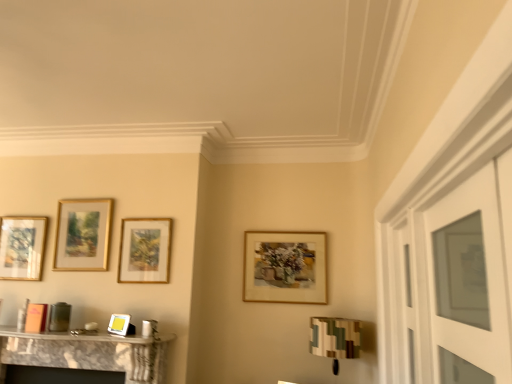
Identify the location of matte gold picture frame at upper center, the third picture frame from the left. (144, 250).

In order to face wooden picture frame at center, the first picture frame positioned from the right, should I rotate leftwards or rightwards?

You should rotate right by 3.938 degrees.

Describe the element at coordinates (455, 282) in the screenshot. I see `clear glass door at right` at that location.

You are a GUI agent. You are given a task and a screenshot of the screen. Output one action in this format:
    pyautogui.click(x=<x>, y=<y>)
    Task: Click on the gold/glossy picture frame at upper left, which is the 3th picture frame from right to left
    
    Given the screenshot: What is the action you would take?
    pyautogui.click(x=83, y=235)

I want to click on matte gold picture frame at upper center, the third picture frame from the left, so click(144, 250).

Between wooden picture frame at center, the 4th picture frame when ordered from left to right, and matte gold picture frame at upper center, marked as the second picture frame in a right-to-left arrangement, which one has smaller width?

matte gold picture frame at upper center, marked as the second picture frame in a right-to-left arrangement, is thinner.

Can matte gold picture frame at upper center, the third picture frame from the left, be found inside wooden picture frame at center, the 4th picture frame when ordered from left to right?

No, matte gold picture frame at upper center, the third picture frame from the left, is located outside of wooden picture frame at center, the 4th picture frame when ordered from left to right.

Is wooden picture frame at center, the 4th picture frame when ordered from left to right, oriented towards matte gold picture frame at upper center, the third picture frame from the left?

No, wooden picture frame at center, the 4th picture frame when ordered from left to right, is not oriented towards matte gold picture frame at upper center, the third picture frame from the left.

Can you tell me how much wooden picture frame at center, the 4th picture frame when ordered from left to right, and matte gold picture frame at upper center, the third picture frame from the left, differ in facing direction?

0.000192 degrees separate the facing orientations of wooden picture frame at center, the 4th picture frame when ordered from left to right, and matte gold picture frame at upper center, the third picture frame from the left.

Considering their positions, is matte gold picture frame at upper center, the third picture frame from the left, located in front of or behind clear glass door at right?

matte gold picture frame at upper center, the third picture frame from the left, is positioned farther from the viewer than clear glass door at right.

Would you consider matte gold picture frame at upper center, marked as the second picture frame in a right-to-left arrangement, to be distant from clear glass door at right?

Yes, matte gold picture frame at upper center, marked as the second picture frame in a right-to-left arrangement, is far from clear glass door at right.

Considering the positions of point (139, 282) and point (479, 296), is point (139, 282) closer or farther from the camera than point (479, 296)?

Point (139, 282) is positioned farther from the camera compared to point (479, 296).

Can you confirm if matte gold picture frame at upper center, the third picture frame from the left, is bigger than clear glass door at right?

Actually, matte gold picture frame at upper center, the third picture frame from the left, might be smaller than clear glass door at right.

Between camouflage fabric lampshade at lower right and gold/glossy picture frame at upper left, positioned as the second picture frame in left-to-right order, which one has smaller size?

gold/glossy picture frame at upper left, positioned as the second picture frame in left-to-right order.

From a real-world perspective, relative to gold/glossy picture frame at upper left, which is the 3th picture frame from right to left, is camouflage fabric lampshade at lower right vertically above or below?

camouflage fabric lampshade at lower right is below gold/glossy picture frame at upper left, which is the 3th picture frame from right to left.

From the image's perspective, who appears lower, camouflage fabric lampshade at lower right or gold/glossy picture frame at upper left, which is the 3th picture frame from right to left?

From the image's view, camouflage fabric lampshade at lower right is below.

Is camouflage fabric lampshade at lower right facing away from gold/glossy picture frame at upper left, which is the 3th picture frame from right to left?

No, camouflage fabric lampshade at lower right is not facing the opposite direction of gold/glossy picture frame at upper left, which is the 3th picture frame from right to left.

How different are the orientations of matte gold picture frame at upper center, the third picture frame from the left, and wooden picture frame at center, the 4th picture frame when ordered from left to right, in degrees?

The angular difference between matte gold picture frame at upper center, the third picture frame from the left, and wooden picture frame at center, the 4th picture frame when ordered from left to right, is 0.000192 degrees.

Starting from the matte gold picture frame at upper center, marked as the second picture frame in a right-to-left arrangement, which picture frame is the 2nd one behind? Please provide its 2D coordinates.

[(285, 267)]

Would you consider matte gold picture frame at upper center, the third picture frame from the left, to be distant from wooden picture frame at center, the 4th picture frame when ordered from left to right?

matte gold picture frame at upper center, the third picture frame from the left, is actually quite close to wooden picture frame at center, the 4th picture frame when ordered from left to right.

Is wooden picture frame at center, the first picture frame positioned from the right, surrounded by matte gold picture frame at upper center, the third picture frame from the left?

Actually, wooden picture frame at center, the first picture frame positioned from the right, is outside matte gold picture frame at upper center, the third picture frame from the left.

Who is taller, camouflage fabric lampshade at lower right or wooden picture frame at center, the first picture frame positioned from the right?

With more height is wooden picture frame at center, the first picture frame positioned from the right.

Identify the location of lamp in front of the wooden picture frame at center, the 4th picture frame when ordered from left to right. Image resolution: width=512 pixels, height=384 pixels. (335, 339).

From the image's perspective, is camouflage fabric lampshade at lower right beneath wooden picture frame at center, the 4th picture frame when ordered from left to right?

Yes.

Does point (354, 324) appear closer or farther from the camera than point (319, 263)?

Point (354, 324) is positioned closer to the camera compared to point (319, 263).

Is point (337, 358) closer to camera compared to point (434, 323)?

No, (337, 358) is behind (434, 323).

Is clear glass door at right located within camouflage fabric lampshade at lower right?

Actually, clear glass door at right is outside camouflage fabric lampshade at lower right.

Considering the relative sizes of camouflage fabric lampshade at lower right and clear glass door at right in the image provided, is camouflage fabric lampshade at lower right smaller than clear glass door at right?

Incorrect, camouflage fabric lampshade at lower right is not smaller in size than clear glass door at right.

From the picture: What's the angular difference between camouflage fabric lampshade at lower right and clear glass door at right's facing directions?

89.1 degrees separate the facing orientations of camouflage fabric lampshade at lower right and clear glass door at right.

Does gold/glossy picture frame at upper left, positioned as the second picture frame in left-to-right order, touch matte gold picture frame at upper center, the third picture frame from the left?

No, gold/glossy picture frame at upper left, positioned as the second picture frame in left-to-right order, is not with matte gold picture frame at upper center, the third picture frame from the left.

The height and width of the screenshot is (384, 512). Identify the location of picture frame that is the 1st object located below the gold/glossy picture frame at upper left, positioned as the second picture frame in left-to-right order (from the image's perspective). (144, 250).

Image resolution: width=512 pixels, height=384 pixels. Identify the location of picture frame on the right of matte gold picture frame at upper center, the third picture frame from the left. (285, 267).

From the image's perspective, which picture frame is the 1st one below the clear glass door at right? Please provide its 2D coordinates.

[(144, 250)]

Considering their positions, is wooden picture frame at center, the first picture frame positioned from the right, positioned closer to gold/glossy picture frame at upper left, which is the 3th picture frame from right to left, than matte gold picture frame at upper center, the third picture frame from the left?

Based on the image, matte gold picture frame at upper center, the third picture frame from the left, appears to be nearer to gold/glossy picture frame at upper left, which is the 3th picture frame from right to left.

Estimate the real-world distances between objects in this image. Which object is further from clear glass door at right, wooden picture frame at center, the 4th picture frame when ordered from left to right, or gold/glossy picture frame at upper left, positioned as the second picture frame in left-to-right order?

gold/glossy picture frame at upper left, positioned as the second picture frame in left-to-right order, is further to clear glass door at right.

Estimate the real-world distances between objects in this image. Which object is closer to gold/glossy picture frame at upper left, positioned as the second picture frame in left-to-right order, wooden picture frame at center, the 4th picture frame when ordered from left to right, or camouflage fabric lampshade at lower right?

wooden picture frame at center, the 4th picture frame when ordered from left to right.

Based on their spatial positions, is wooden picture frame at center, the first picture frame positioned from the right, or gold-framed picture at left, which is the 1th picture frame in left-to-right order, further from gold/glossy picture frame at upper left, which is the 3th picture frame from right to left?

Among the two, wooden picture frame at center, the first picture frame positioned from the right, is located further to gold/glossy picture frame at upper left, which is the 3th picture frame from right to left.

From the picture: Looking at the image, which one is located further to clear glass door at right, camouflage fabric lampshade at lower right or matte gold picture frame at upper center, marked as the second picture frame in a right-to-left arrangement?

Based on the image, matte gold picture frame at upper center, marked as the second picture frame in a right-to-left arrangement, appears to be further to clear glass door at right.

Which object lies further to the anchor point camouflage fabric lampshade at lower right, gold/glossy picture frame at upper left, positioned as the second picture frame in left-to-right order, or matte gold picture frame at upper center, the third picture frame from the left?

The object further to camouflage fabric lampshade at lower right is gold/glossy picture frame at upper left, positioned as the second picture frame in left-to-right order.

Looking at the image, which one is located closer to clear glass door at right, wooden picture frame at center, the first picture frame positioned from the right, or gold-framed picture at left, placed as the fourth picture frame when sorted from right to left?

wooden picture frame at center, the first picture frame positioned from the right, is positioned closer to the anchor clear glass door at right.

When comparing their distances from gold-framed picture at left, placed as the fourth picture frame when sorted from right to left, does gold/glossy picture frame at upper left, which is the 3th picture frame from right to left, or clear glass door at right seem closer?

gold/glossy picture frame at upper left, which is the 3th picture frame from right to left, lies closer to gold-framed picture at left, placed as the fourth picture frame when sorted from right to left, than the other object.

Locate an element on the screen. This screenshot has width=512, height=384. lamp between clear glass door at right and gold/glossy picture frame at upper left, positioned as the second picture frame in left-to-right order, from front to back is located at coordinates (335, 339).

Image resolution: width=512 pixels, height=384 pixels. I want to click on lamp between clear glass door at right and wooden picture frame at center, the 4th picture frame when ordered from left to right, along the z-axis, so click(x=335, y=339).

Where is `picture frame between clear glass door at right and gold/glossy picture frame at upper left, positioned as the second picture frame in left-to-right order, in the front-back direction`? Image resolution: width=512 pixels, height=384 pixels. picture frame between clear glass door at right and gold/glossy picture frame at upper left, positioned as the second picture frame in left-to-right order, in the front-back direction is located at coordinates (144, 250).

Image resolution: width=512 pixels, height=384 pixels. What are the coordinates of `picture frame between gold/glossy picture frame at upper left, positioned as the second picture frame in left-to-right order, and wooden picture frame at center, the first picture frame positioned from the right, from left to right` in the screenshot? It's located at (144, 250).